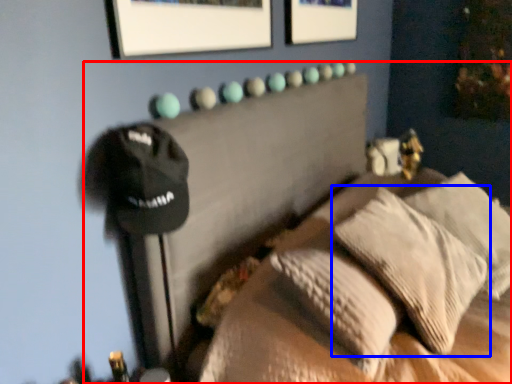
Question: Which object appears closest to the camera in this image, furniture (highlighted by a red box) or pillow (highlighted by a blue box)?

Choices:
 (A) furniture
 (B) pillow

Answer: (A)